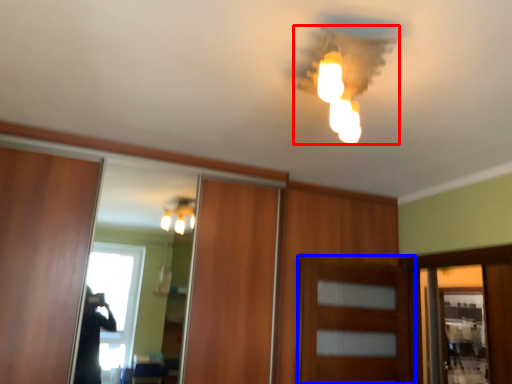
Question: Which point is further to the camera, lamp (highlighted by a red box) or door (highlighted by a blue box)?

Choices:
 (A) lamp
 (B) door

Answer: (B)